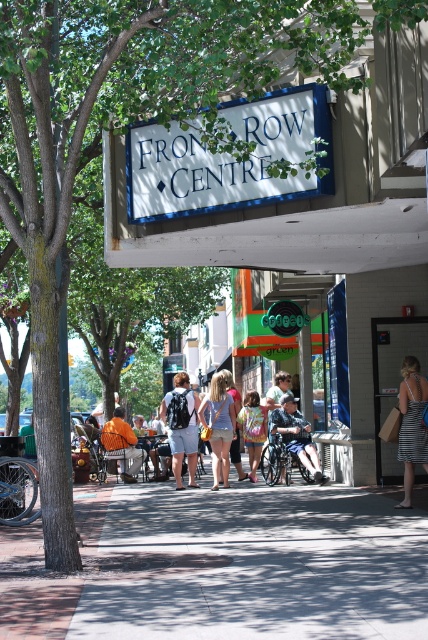
You are standing on the sidewalk in front of the store with the colorful awning. You see two points marked in the scene. Which point is closer to you, point (x=282, y=396) or point (x=109, y=452)?

Point (x=282, y=396) is closer to you because it is further to the viewer than point (x=109, y=452).